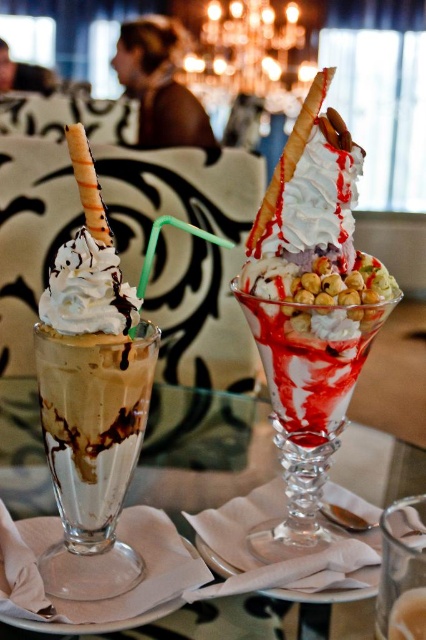
Does white creamy ice cream sundae at center appear under transparent glass table at center?

No, white creamy ice cream sundae at center is not below transparent glass table at center.

Who is higher up, white creamy ice cream sundae at center or transparent glass table at center?

white creamy ice cream sundae at center is above.

Does point (273, 394) lie behind point (270, 452)?

No.

The image size is (426, 640). What are the coordinates of `white creamy ice cream sundae at center` in the screenshot? It's located at (310, 308).